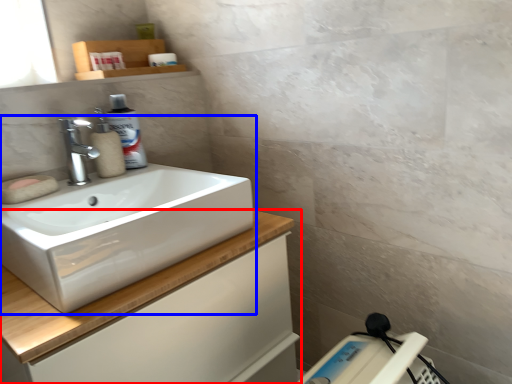
Question: Which point is closer to the camera, bathroom cabinet (highlighted by a red box) or sink (highlighted by a blue box)?

Choices:
 (A) bathroom cabinet
 (B) sink

Answer: (A)